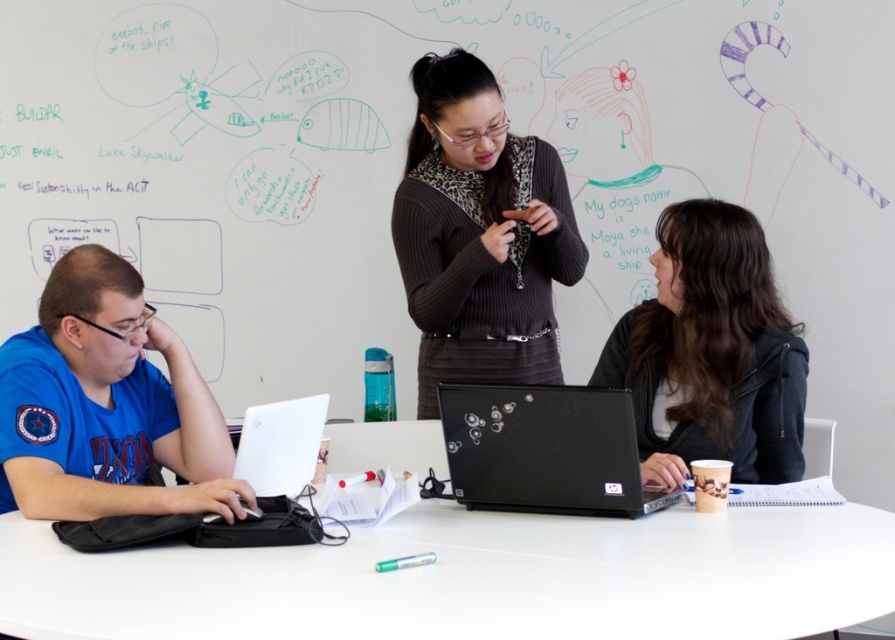
Question: Is matte black sweater at center smaller than white glossy laptop at lower left?

Choices:
 (A) yes
 (B) no

Answer: (B)

Question: Can you confirm if white glossy table at center is positioned above matte black sweater at center?

Choices:
 (A) no
 (B) yes

Answer: (A)

Question: Which point is farther from the camera taking this photo?

Choices:
 (A) click(x=239, y=440)
 (B) click(x=459, y=276)

Answer: (B)

Question: Which is nearer to the matte black sweater at center?

Choices:
 (A) white glossy laptop at lower left
 (B) white glossy table at center
 (C) black matte jacket at center
 (D) black glossy laptop at center

Answer: (C)

Question: Is white glossy table at center to the left of white glossy laptop at lower left from the viewer's perspective?

Choices:
 (A) no
 (B) yes

Answer: (A)

Question: Based on their relative distances, which object is farther from the black glossy laptop at center?

Choices:
 (A) matte black sweater at center
 (B) black matte jacket at center

Answer: (A)